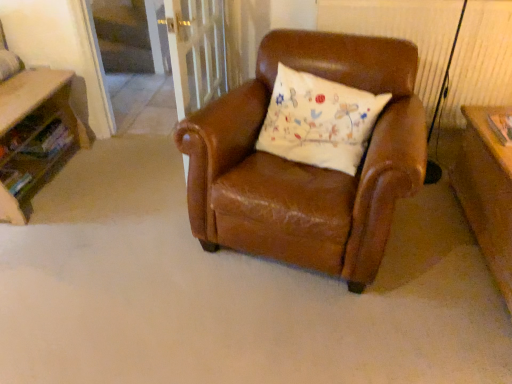
The height and width of the screenshot is (384, 512). In order to click on free location above wooden table at left (from a real-world perspective) in this screenshot , I will do `click(20, 91)`.